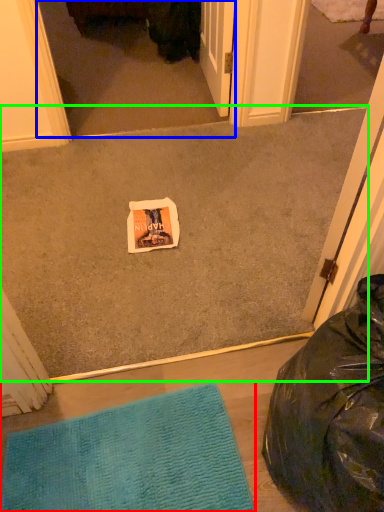
Question: Which is farther away from mat (highlighted by a red box)? screen door (highlighted by a blue box) or concrete (highlighted by a green box)?

Choices:
 (A) screen door
 (B) concrete

Answer: (A)